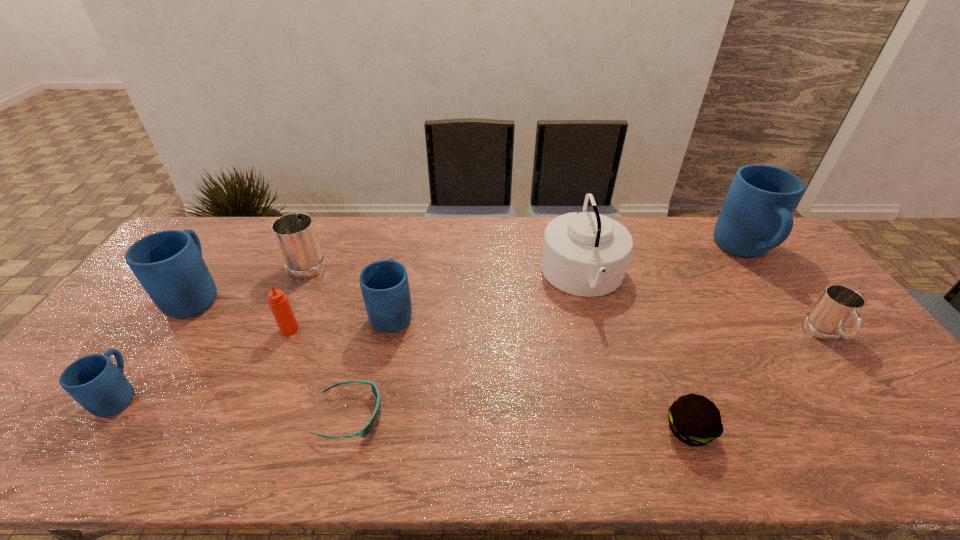
You are a GUI agent. You are given a task and a screenshot of the screen. Output one action in this format:
    pyautogui.click(x=<x>, y=<y>)
    Task: Click on the biggest blue mug
    The height and width of the screenshot is (540, 960).
    Given the screenshot: What is the action you would take?
    pyautogui.click(x=755, y=217)

You are a GUI agent. You are given a task and a screenshot of the screen. Output one action in this format:
    pyautogui.click(x=<x>, y=<y>)
    Task: Click on the tallest mug
    The height and width of the screenshot is (540, 960).
    Given the screenshot: What is the action you would take?
    pyautogui.click(x=755, y=217)

Locate an element on the screen. This screenshot has height=540, width=960. white kettle is located at coordinates (584, 253).

I want to click on the second biggest blue mug, so click(x=168, y=264).

Where is `the left gray mug`? the left gray mug is located at coordinates (295, 234).

This screenshot has height=540, width=960. What are the coordinates of `the bigger gray mug` in the screenshot? It's located at (295, 234).

Locate an element on the screen. The image size is (960, 540). the third blue mug from left to right is located at coordinates (384, 284).

Where is `the third biggest blue mug`? The image size is (960, 540). the third biggest blue mug is located at coordinates (384, 284).

You are a GUI agent. You are given a task and a screenshot of the screen. Output one action in this format:
    pyautogui.click(x=<x>, y=<y>)
    Task: Click on the Tabasco sauce
    This screenshot has height=540, width=960.
    Given the screenshot: What is the action you would take?
    pyautogui.click(x=279, y=304)

Find the location of a particular element. the nearer gray mug is located at coordinates (838, 305).